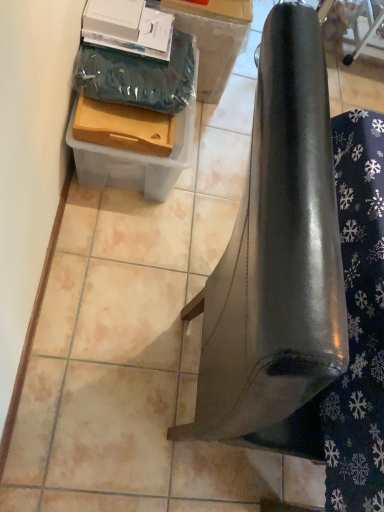
Identify the location of vacant space situated above wooden drawer at upper left (from a real-world perspective). (128, 95).